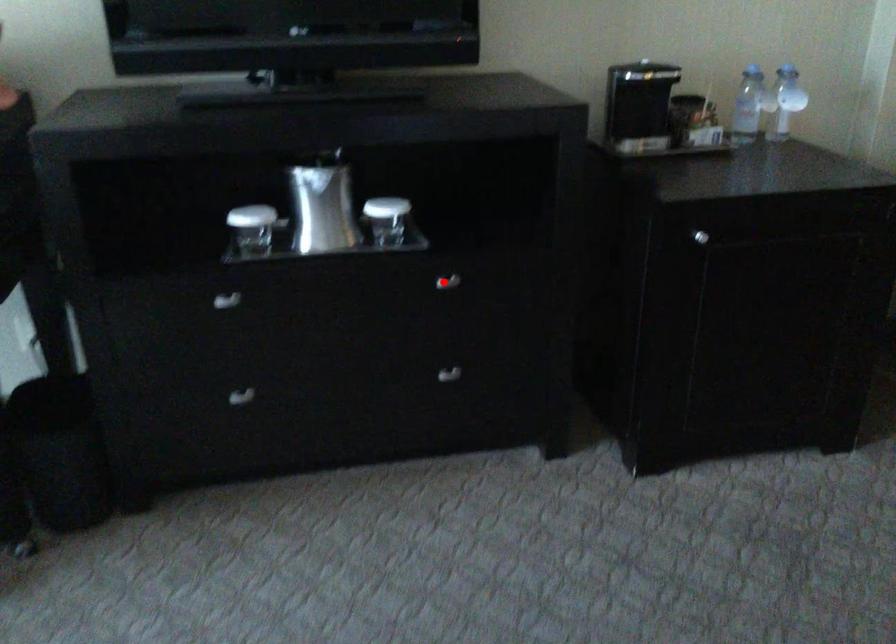
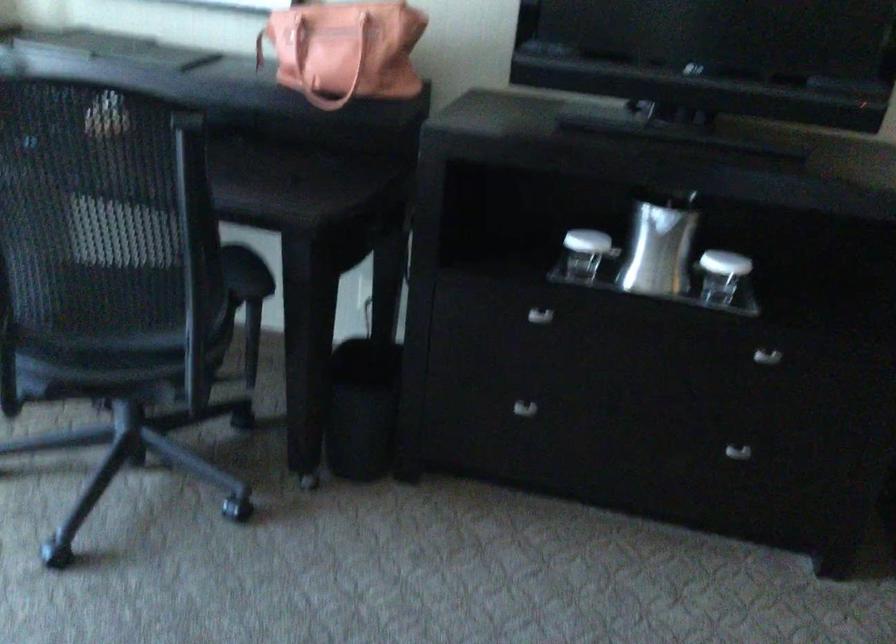
In the second image, find the point that corresponds to the highlighted location in the first image.

(767, 357)